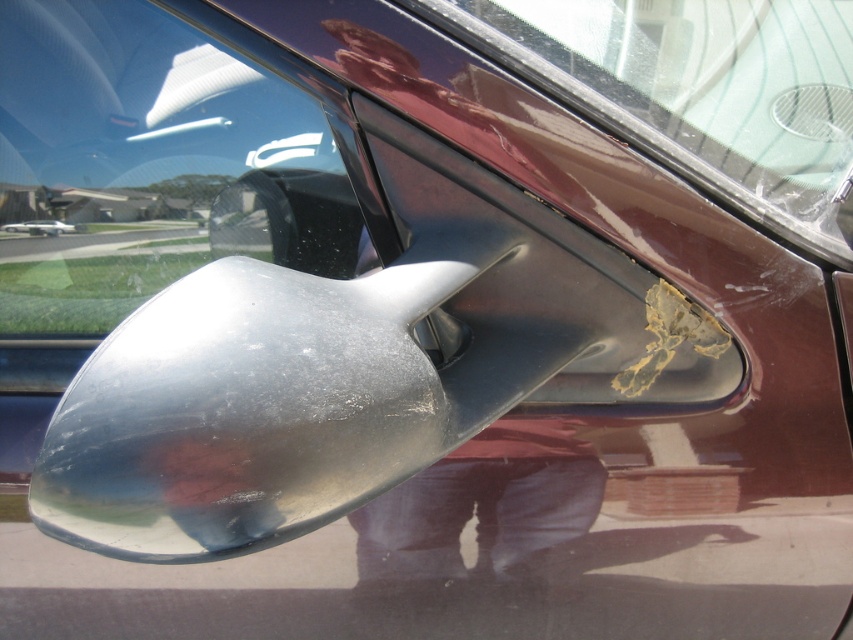
You are a driver looking at the car from the front. Where is the transparent glass car window at upper left located in terms of coordinates?

The transparent glass car window at upper left is located at coordinates point (148, 163).

You are a car inspector checking the vehicle for damage. You notice two transparent surfaces on the car. Which one is positioned to the left of the other? The transparent glass car window at upper left and the transparent plastic windshield at upper center are both in your view. Can you determine their relative positions?

The transparent glass car window at upper left is positioned to the left of the transparent plastic windshield at upper center.

You are a passenger in the car and want to look outside through the transparent glass car window at upper left and the transparent plastic windshield at upper center. Which one would you look through to see what is directly in front of the car?

The transparent plastic windshield at upper center is behind the transparent glass car window at upper left. To see what is directly in front of the car, you should look through the transparent plastic windshield at upper center because it is positioned closer to the front of the car compared to the transparent glass car window at upper left.